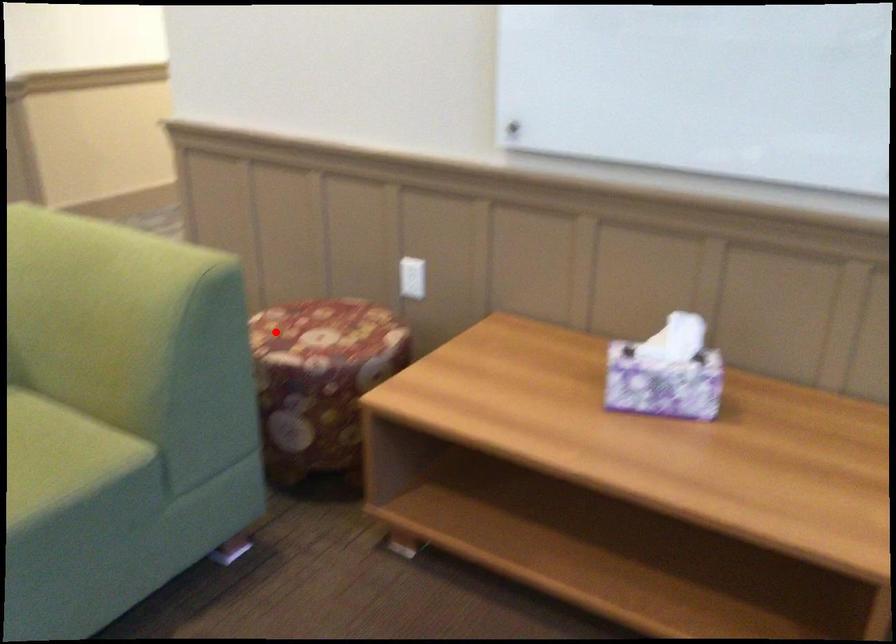
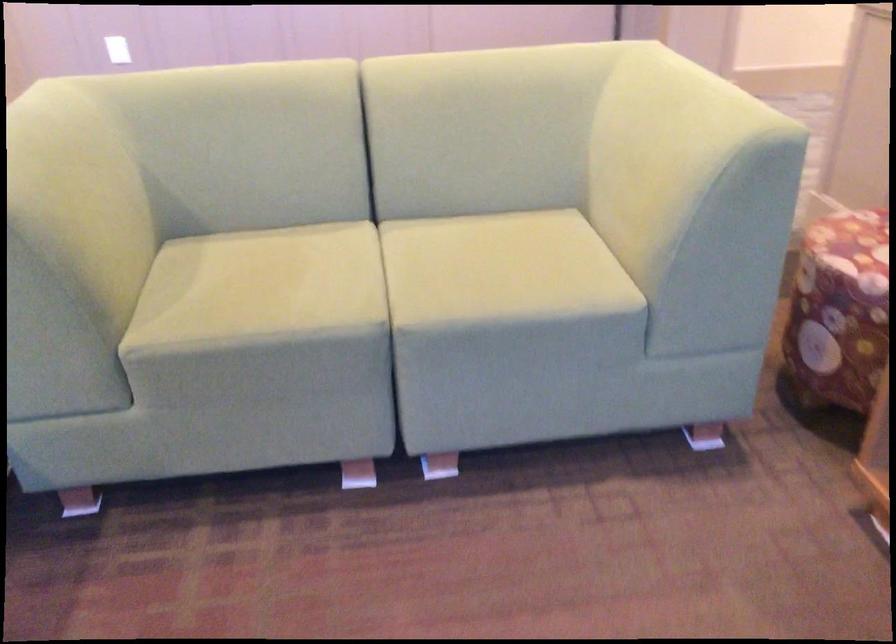
Question: A red point is marked in image1. In image2, is the corresponding 3D point closer to the camera or farther? Reply with the corresponding letter.

Choices:
 (A) The corresponding 3D point is closer.
 (B) The corresponding 3D point is farther.

Answer: (A)